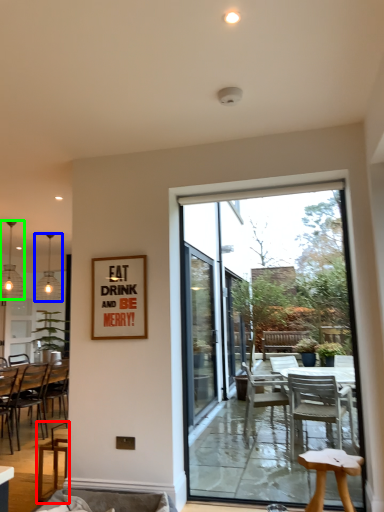
Question: Which object is the closest to the chair (highlighted by a red box)? Choose among these: lamp (highlighted by a blue box) or lamp (highlighted by a green box).

Choices:
 (A) lamp
 (B) lamp

Answer: (B)